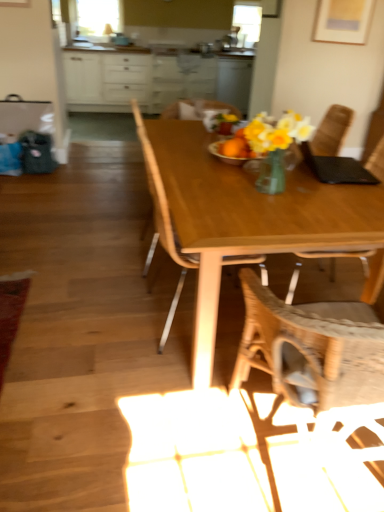
This screenshot has height=512, width=384. Find the location of `vacant space in front of wooden chair at center, the first chair positioned from the left`. vacant space in front of wooden chair at center, the first chair positioned from the left is located at coordinates (148, 403).